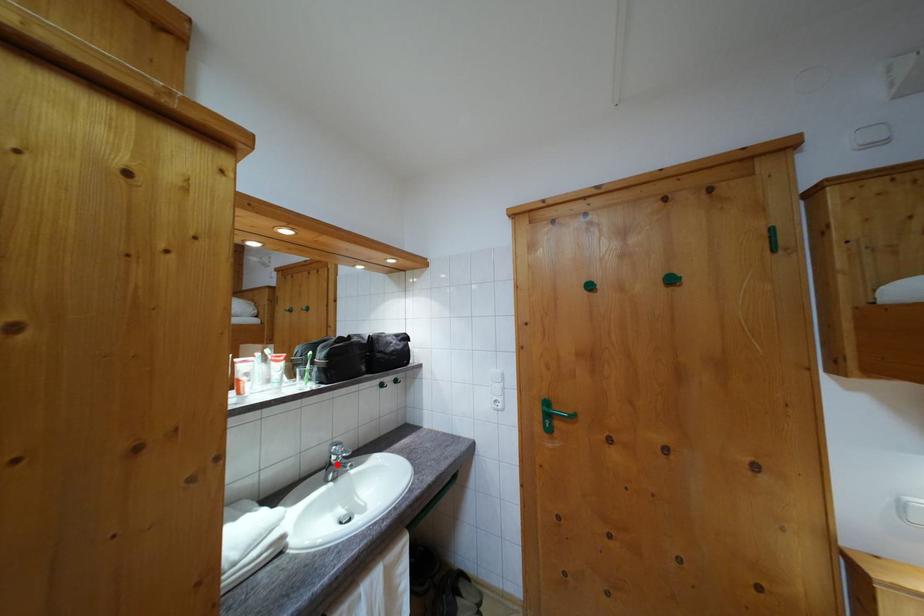
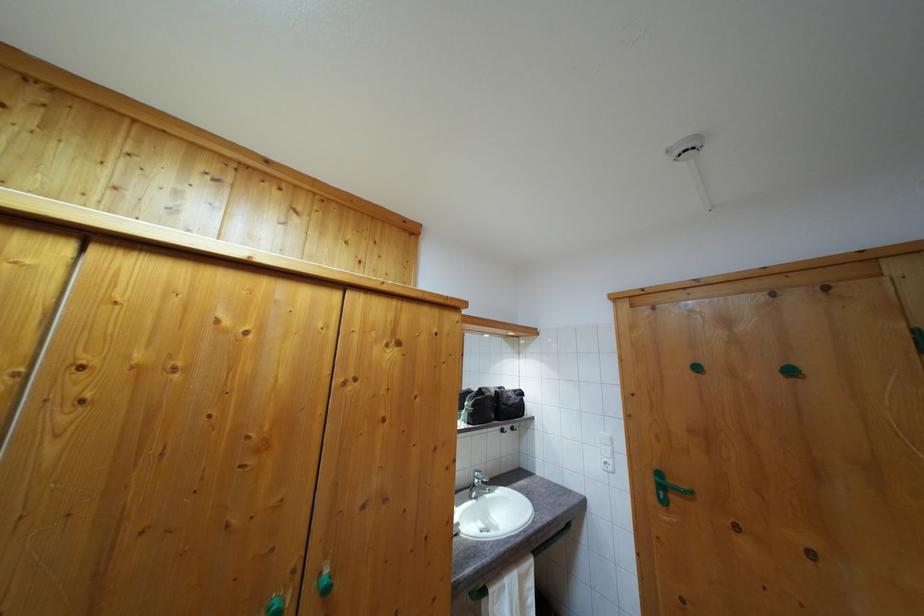
Question: I am providing you with two images of the same scene from different viewpoints. A red point is shown in image1. For the corresponding object point in image2, is it positioned nearer or farther from the camera?

Choices:
 (A) Nearer
 (B) Farther

Answer: (B)